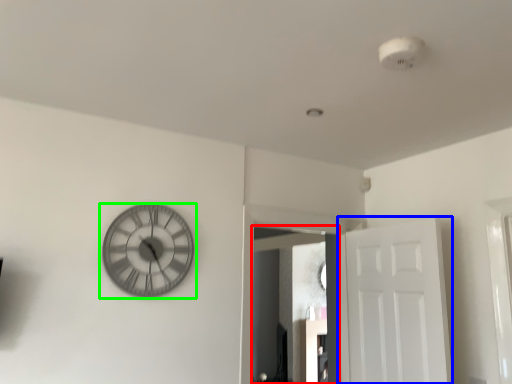
Question: Considering the real-world distances, which object is farthest from mirror (highlighted by a red box)? door (highlighted by a blue box) or wall clock (highlighted by a green box)?

Choices:
 (A) door
 (B) wall clock

Answer: (B)